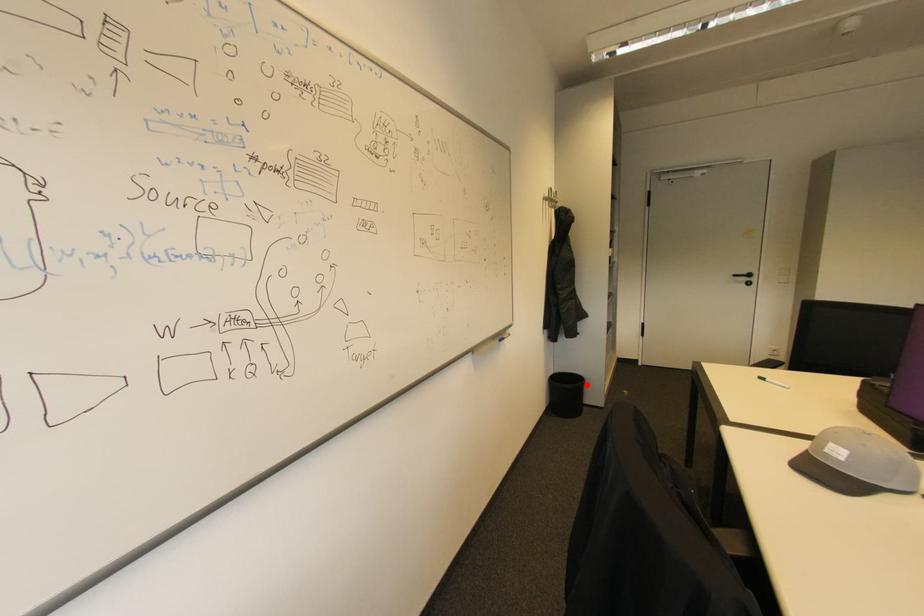
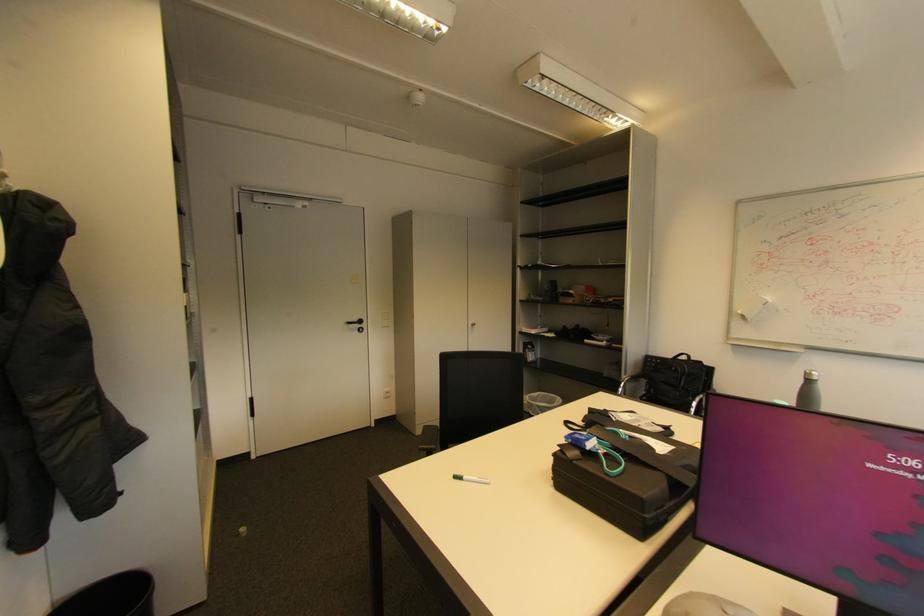
Find the pixel in the second image that matches the highlighted location in the first image.

(150, 599)